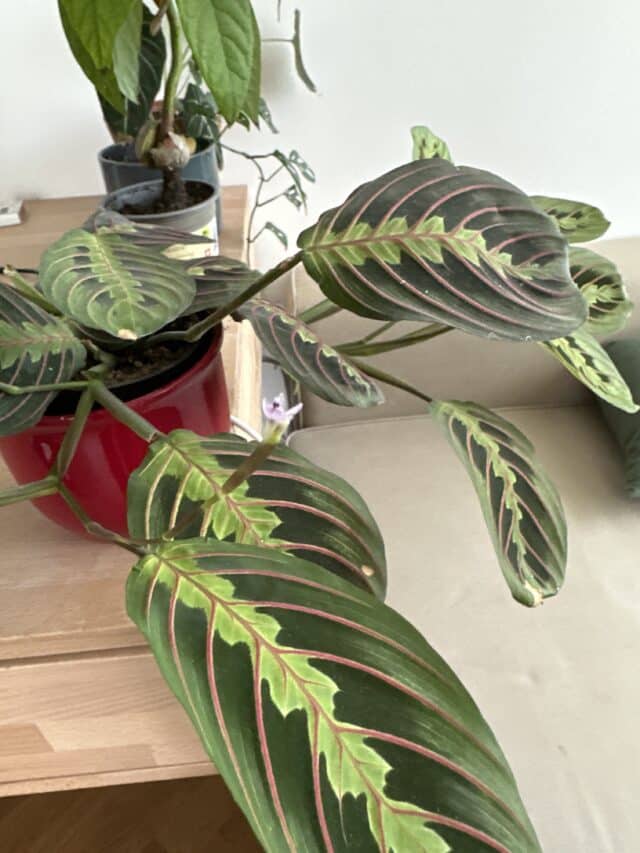
Identify the location of furniture. (76, 622), (483, 624).